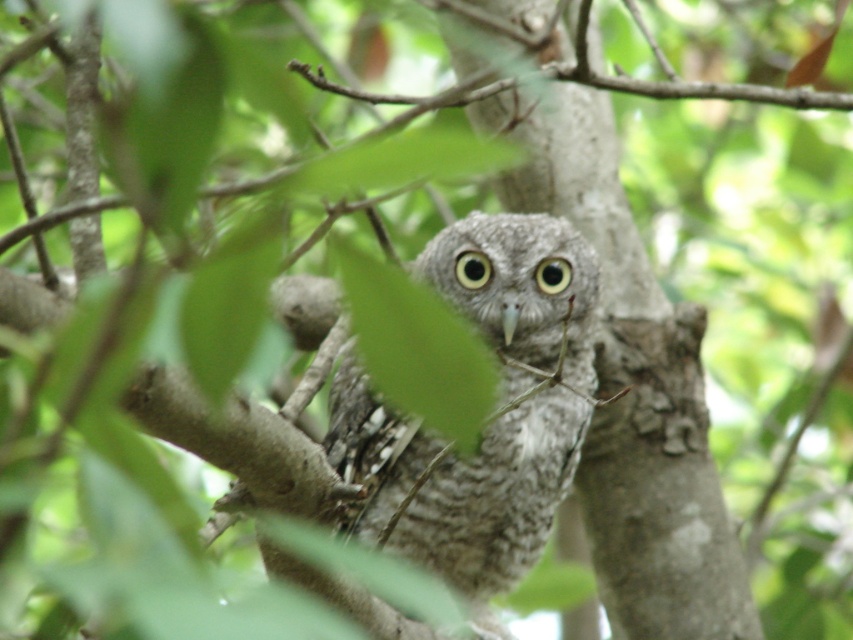
Question: Which of these objects is positioned closest to the yellow matte eye at center?

Choices:
 (A) speckled gray owl at center
 (B) black matte eye at center

Answer: (B)

Question: Estimate the real-world distances between objects in this image. Which object is closer to the speckled gray owl at center?

Choices:
 (A) black matte eye at center
 (B) yellow matte eye at center

Answer: (A)

Question: Is speckled gray owl at center to the left of black matte eye at center from the viewer's perspective?

Choices:
 (A) no
 (B) yes

Answer: (A)

Question: Does black matte eye at center have a smaller size compared to yellow matte eye at center?

Choices:
 (A) yes
 (B) no

Answer: (A)

Question: Can you confirm if speckled gray owl at center is positioned below black matte eye at center?

Choices:
 (A) yes
 (B) no

Answer: (A)

Question: Which point is farther to the camera?

Choices:
 (A) yellow matte eye at center
 (B) speckled gray owl at center
 (C) black matte eye at center

Answer: (A)